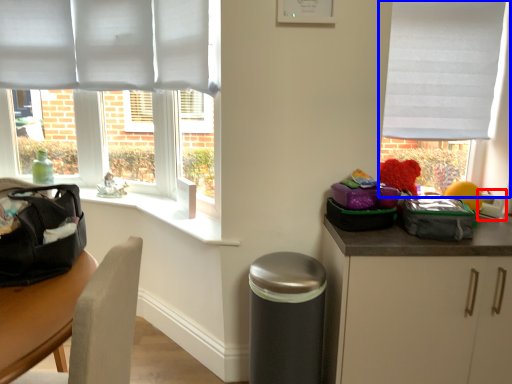
Question: Which point is further to the camera, appliance (highlighted by a red box) or window (highlighted by a blue box)?

Choices:
 (A) appliance
 (B) window

Answer: (B)